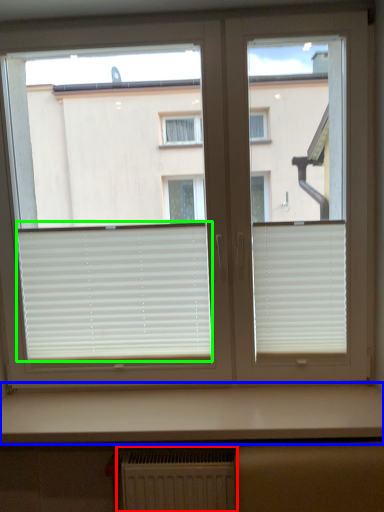
Question: Which is nearer to the radiator (highlighted by a red box)? counter top (highlighted by a blue box) or window blind (highlighted by a green box).

Choices:
 (A) counter top
 (B) window blind

Answer: (A)